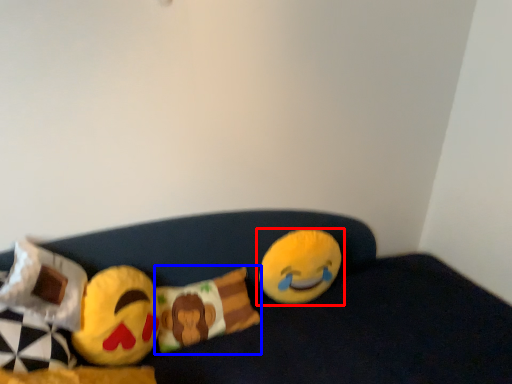
Question: Which of the following is the farthest to the observer, toy (highlighted by a red box) or pillow (highlighted by a blue box)?

Choices:
 (A) toy
 (B) pillow

Answer: (A)